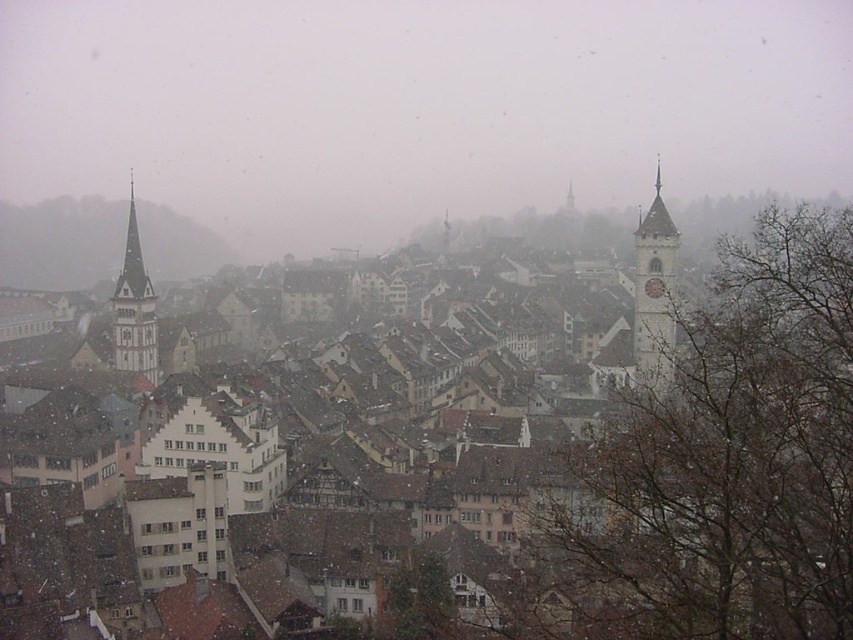
You are standing at the center of the historic town and want to walk to both points. Which point, point [701,577] or point [668,260], will you reach first?

You will reach point [701,577] first because it is closer to you than point [668,260].

You are a drone operator trying to capture a photo of the brown tiled roofs at center in the historic town. The drone is currently at coordinates point A. To ensure the roofs are in the center of the photo, should you adjust the drone to move north or south? Please provide your reasoning based on the roofs location at point 0.720, 0.853.

The brown tiled roofs at center are located at coordinates point (727, 460). Since the y coordinate 0.853 is closer to 1.0 than 0.0, the roofs are positioned lower in the image. To center them, the drone should move north to bring them higher into the frame.

You are a delivery drone with a maximum flight range of 50 meters. You need to deliver a package from the brown tiled roofs at center to the white stone clock tower at right. Can you complete the delivery without needing to recharge?

The distance between the brown tiled roofs at center and the white stone clock tower at right is 47.43 meters, which is within the drone s 50 meter range. Yes, the drone can complete the delivery without recharging.